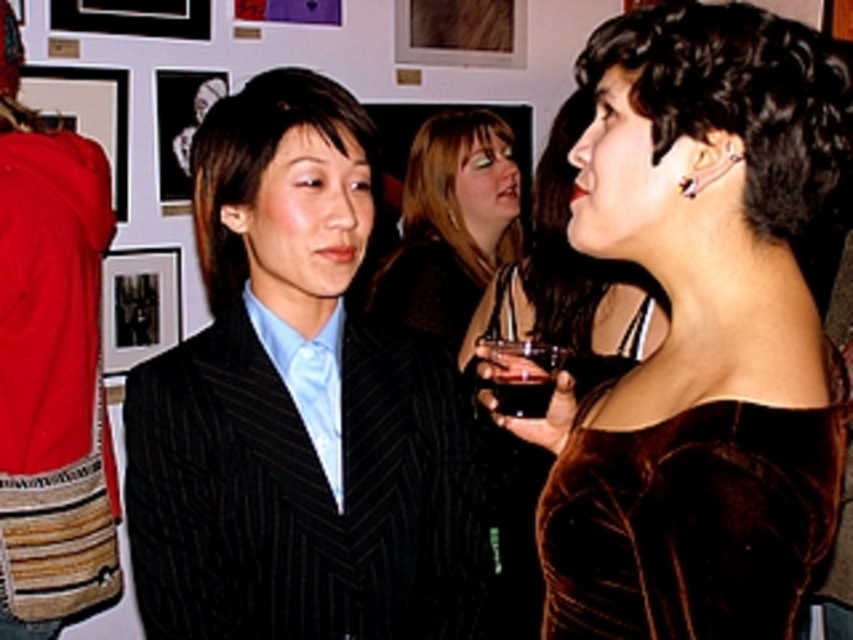
You are a photographer at the event and need to capture a closeup of the pinstriped suit at center and the dark liquid glass at center. What is the minimum distance you need to maintain between the camera and the objects to ensure both are in focus?

The minimum distance required is 42.26 centimeters, as that is the distance between the pinstriped suit at center and the dark liquid glass at center.

From the picture: You are standing at the point marked as point (289, 100) in the image. You want to take a photo of the two women in the foreground without them noticing. The camera requires a minimum distance of 4 feet to avoid blurring. Can you take the photo from your current position?

The distance of point (289, 100) from camera is 4.51 feet, which is greater than the minimum required distance of 4 feet. Therefore, you can take the photo from your current position without blurring.